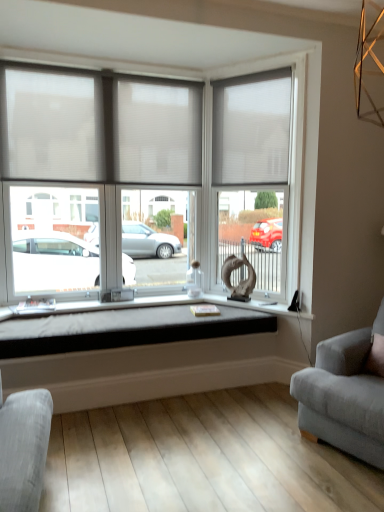
Question: From the image's perspective, is white fabric window blind at upper right, the 2th window blind when ordered from left to right, located above or below translucent fabric window at center?

Choices:
 (A) below
 (B) above

Answer: (B)

Question: From a real-world perspective, is white fabric window blind at upper right, which is the 1th window blind in right-to-left order, positioned above or below translucent fabric window at center?

Choices:
 (A) below
 (B) above

Answer: (B)

Question: Which is farther from the white sheer blinds at upper left, the 1th window blind from the left?

Choices:
 (A) soft gray fabric couch at right
 (B) black fabric cushion at center
 (C) matte glass door at center
 (D) white fabric window blind at upper right, the 2th window blind when ordered from left to right
 (E) translucent fabric window at center

Answer: (A)

Question: Considering the real-world distances, which object is closest to the translucent fabric window at center?

Choices:
 (A) white fabric window blind at upper right, the 2th window blind when ordered from left to right
 (B) white sheer blinds at upper left, arranged as the second window blind when viewed from the right
 (C) matte glass door at center
 (D) black fabric cushion at center
 (E) soft gray fabric couch at right

Answer: (B)